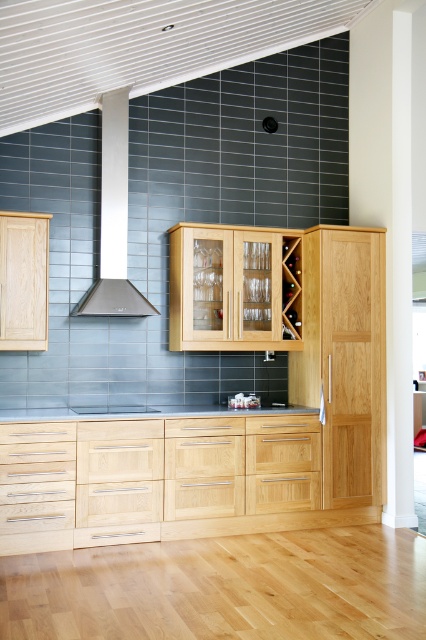
Question: Among these objects, which one is nearest to the camera?

Choices:
 (A) matte wood countertop at center
 (B) light wood cabinet at center
 (C) natural wood cabinet at left
 (D) white glossy exhaust hood at upper center

Answer: (B)

Question: Which of these objects is positioned farthest from the wooden cabinet at center?

Choices:
 (A) matte wood countertop at center
 (B) light wood cabinet at center
 (C) black laminate countertop at center

Answer: (A)

Question: Is wooden cabinet at center positioned in front of white glossy exhaust hood at upper center?

Choices:
 (A) no
 (B) yes

Answer: (A)

Question: Considering the relative positions of wooden cabinet at center and white glossy exhaust hood at upper center in the image provided, where is wooden cabinet at center located with respect to white glossy exhaust hood at upper center?

Choices:
 (A) above
 (B) below

Answer: (B)

Question: Which point appears closest to the camera in this image?

Choices:
 (A) (294, 324)
 (B) (112, 116)

Answer: (B)

Question: Is light wood cabinet at center below wooden cabinet at center?

Choices:
 (A) yes
 (B) no

Answer: (A)